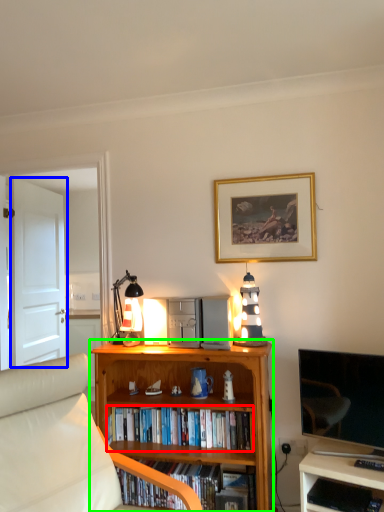
Question: Which object is the closest to the book (highlighted by a red box)? Choose among these: door (highlighted by a blue box) or bookcase (highlighted by a green box).

Choices:
 (A) door
 (B) bookcase

Answer: (B)